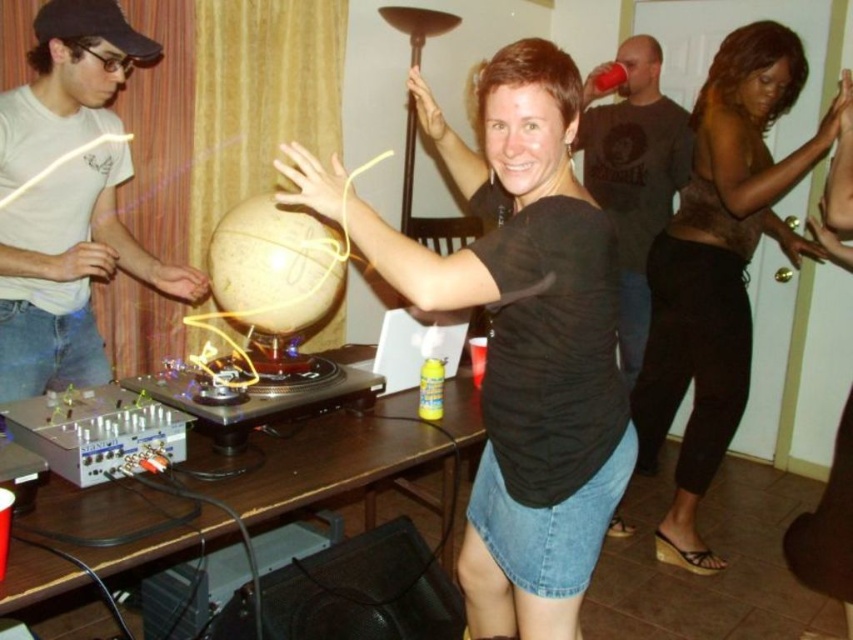
Is brown sheer top at upper right shorter than dark gray t-shirt at upper right?

In fact, brown sheer top at upper right may be taller than dark gray t-shirt at upper right.

Is brown sheer top at upper right smaller than dark gray t-shirt at upper right?

Actually, brown sheer top at upper right might be larger than dark gray t-shirt at upper right.

Describe the element at coordinates (718, 266) in the screenshot. The image size is (853, 640). I see `brown sheer top at upper right` at that location.

The height and width of the screenshot is (640, 853). I want to click on brown sheer top at upper right, so click(x=718, y=266).

Who is lower down, black matte shirt at center or brown wooden table at center?

brown wooden table at center

Can you confirm if black matte shirt at center is thinner than brown wooden table at center?

Yes, black matte shirt at center is thinner than brown wooden table at center.

Locate an element on the screen. black matte shirt at center is located at coordinates (518, 337).

Is brown sheer top at upper right to the left of matte white shirt at upper left from the viewer's perspective?

No, brown sheer top at upper right is not to the left of matte white shirt at upper left.

Between brown sheer top at upper right and matte white shirt at upper left, which one has less height?

With less height is matte white shirt at upper left.

The image size is (853, 640). Describe the element at coordinates (718, 266) in the screenshot. I see `brown sheer top at upper right` at that location.

This screenshot has width=853, height=640. What are the coordinates of `brown sheer top at upper right` in the screenshot? It's located at (718, 266).